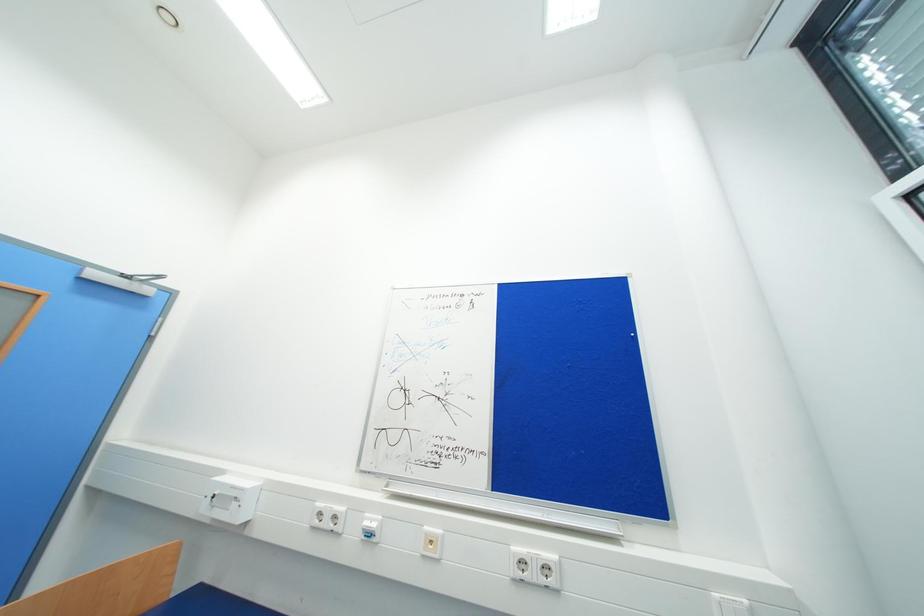
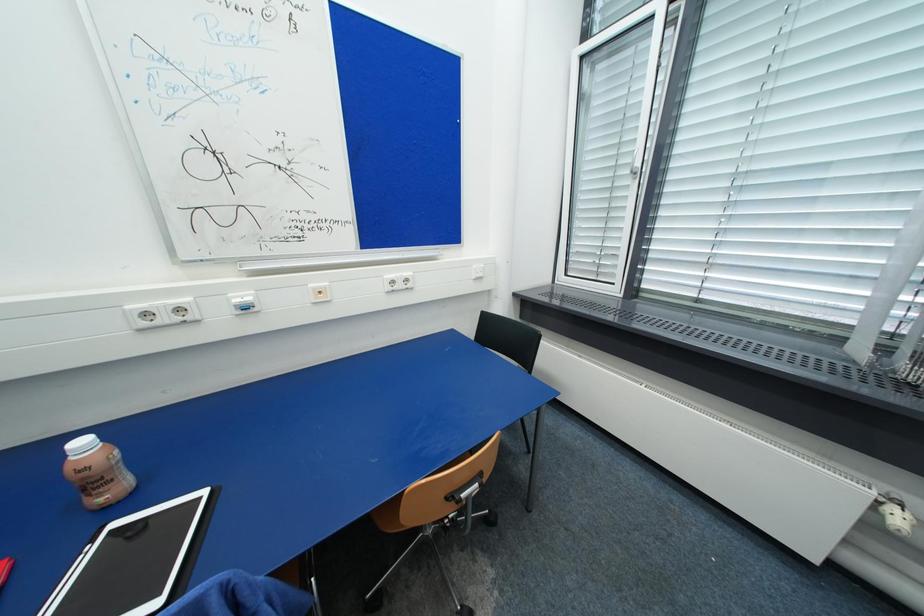
The first image is from the beginning of the video and the second image is from the end. How did the camera likely rotate when shooting the video?

The camera rotated toward right-down.